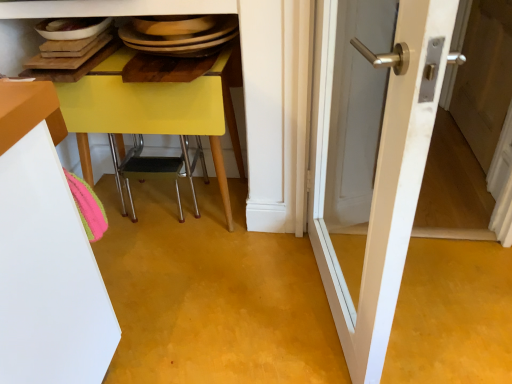
Image resolution: width=512 pixels, height=384 pixels. Identify the location of vacant space that is to the left of white glossy door at center. (227, 314).